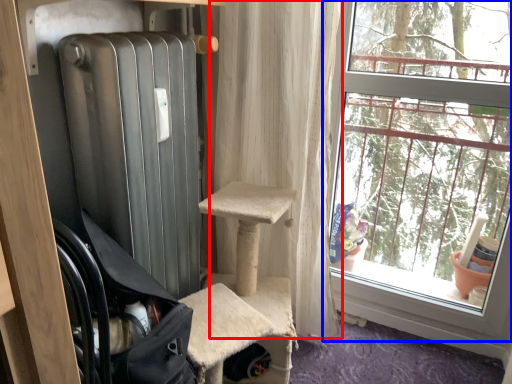
Question: Which object is further to the camera taking this photo, curtain (highlighted by a red box) or window (highlighted by a blue box)?

Choices:
 (A) curtain
 (B) window

Answer: (A)